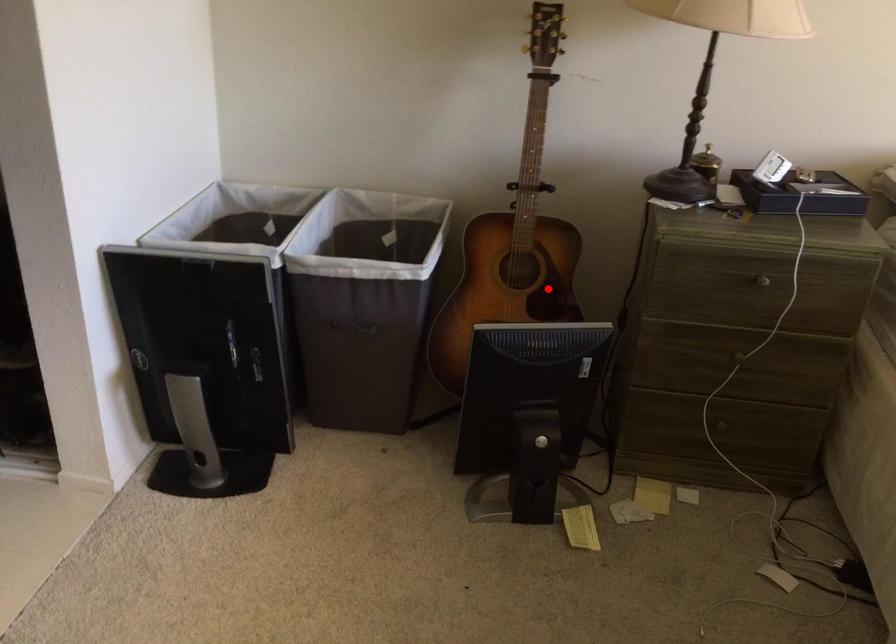
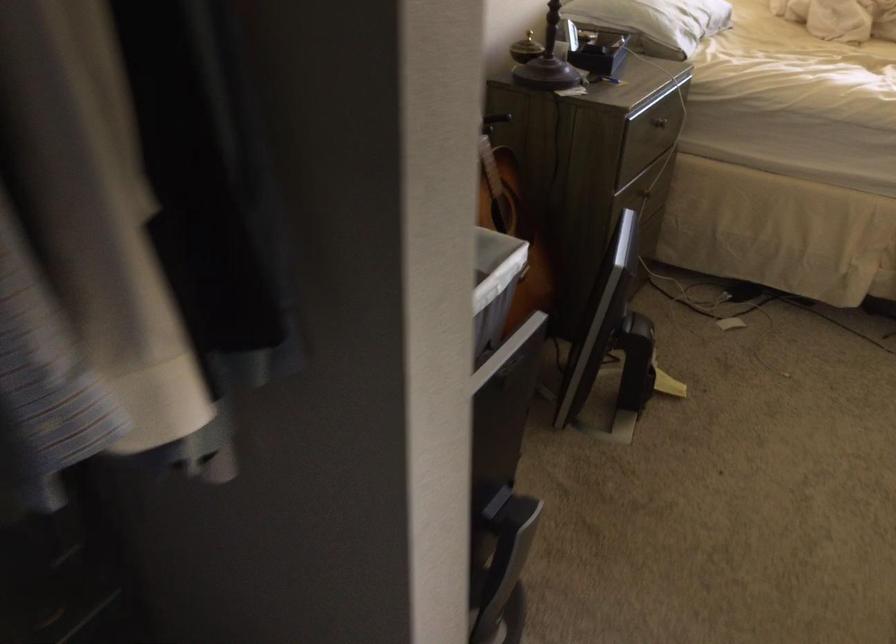
Locate, in the second image, the point that corresponds to the highlighted location in the first image.

(513, 227)